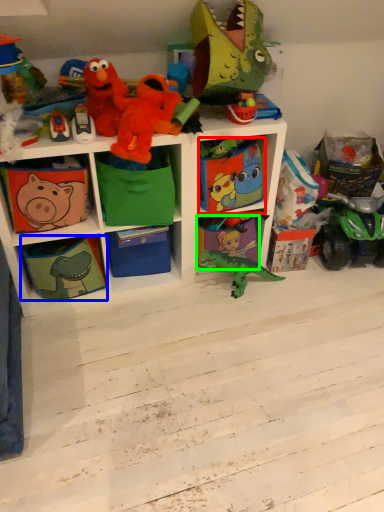
Question: Considering the real-world distances, which object is closest to box (highlighted by a red box)? shelf (highlighted by a blue box) or shelf (highlighted by a green box).

Choices:
 (A) shelf
 (B) shelf

Answer: (B)